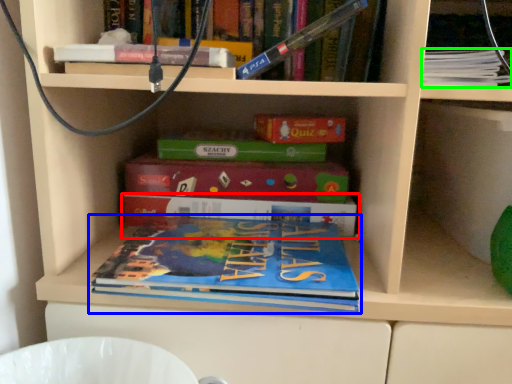
Question: Based on their relative distances, which object is farther from book (highlighted by a red box)? Choose from book (highlighted by a blue box) and book (highlighted by a green box).

Choices:
 (A) book
 (B) book

Answer: (B)